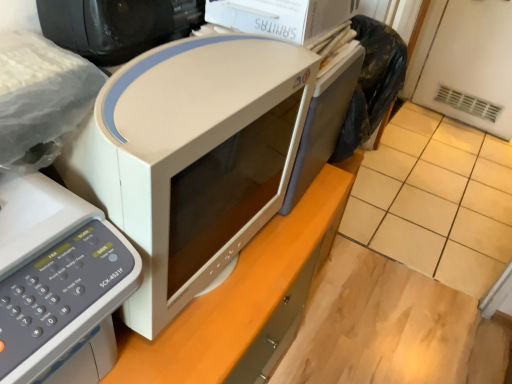
Identify the location of vacant area on top of white matte microwave at center, the first home appliance from the right (from a real-world perspective). This screenshot has width=512, height=384. (180, 67).